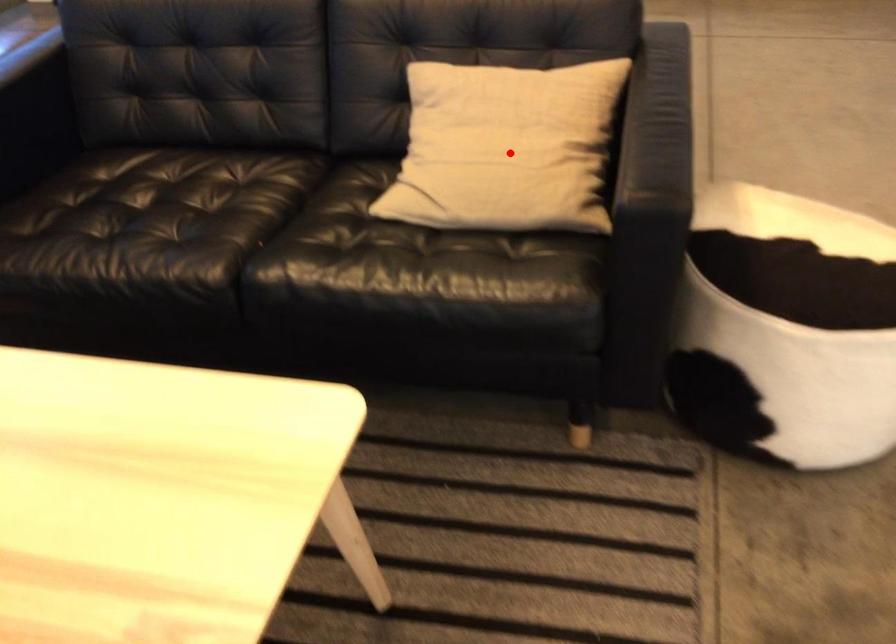
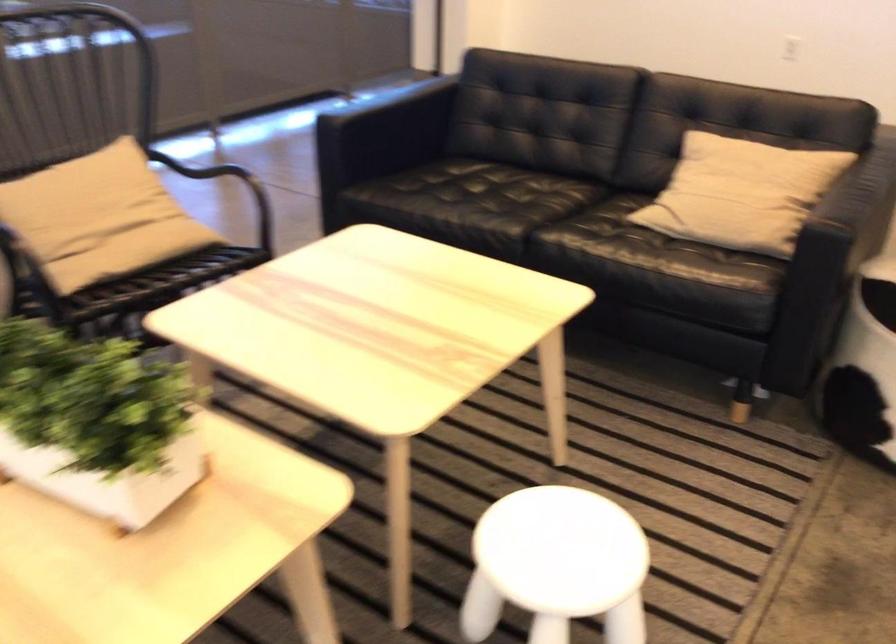
Question: I am providing you with two images of the same scene from different viewpoints. Given a red point in image1, look at the same physical point in image2. Is it:

Choices:
 (A) Closer to the viewpoint
 (B) Farther from the viewpoint

Answer: (B)